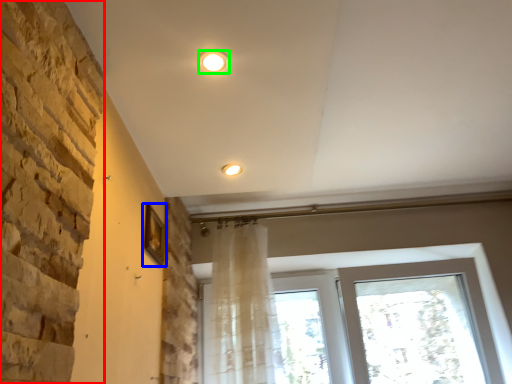
Question: Based on their relative distances, which object is nearer to brickwork (highlighted by a red box)? Choose from picture frame (highlighted by a blue box) and lighting (highlighted by a green box).

Choices:
 (A) picture frame
 (B) lighting

Answer: (B)